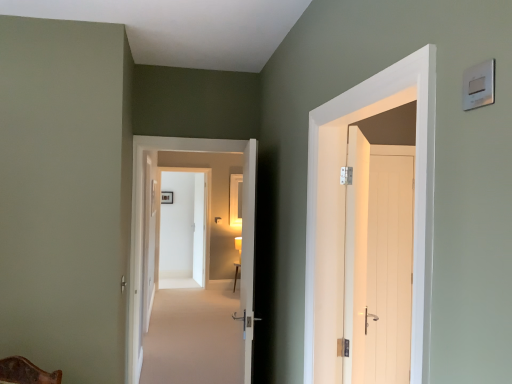
Locate an element on the screen. free location in front of white glossy door at center, the 6th door viewed from the right is located at coordinates (185, 295).